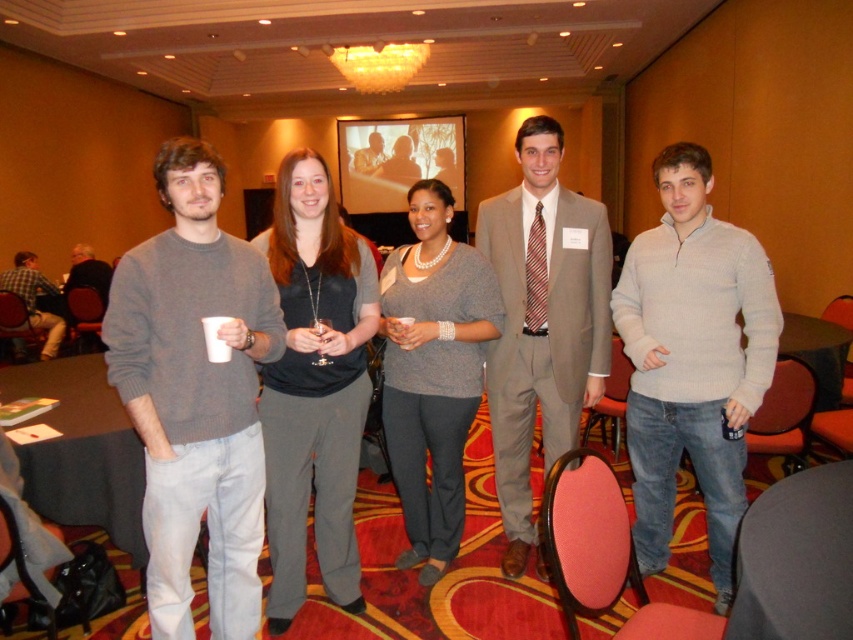
You are organizing a photo shoot and need to place two props in the scene. The first prop is a small decorative pillow for the matte gray pants at center, and the second is a large decorative pillow for the dark gray sweater at left. Based on the spatial arrangement, which prop would you place closer to the edge of the frame?

The matte gray pants at center occupies less space than the dark gray sweater at left, so the small decorative pillow should be placed closer to the edge of the frame to avoid overwhelming the smaller object.

You are a photographer positioned at the center of the room. You want to take a photo of the dark gray fabric table at lower left without including the matte gray pants at center in the frame. Is the distance between them sufficient to allow you to zoom in on the table while keeping the pants out of the shot?

The distance between matte gray pants at center and dark gray fabric table at lower left is 92.68 centimeters. Since the pants are closer to the photographer, zooming in on the table from the center would likely keep the pants out of the frame due to the distance and angle, assuming the camera has a sufficient zoom capability.